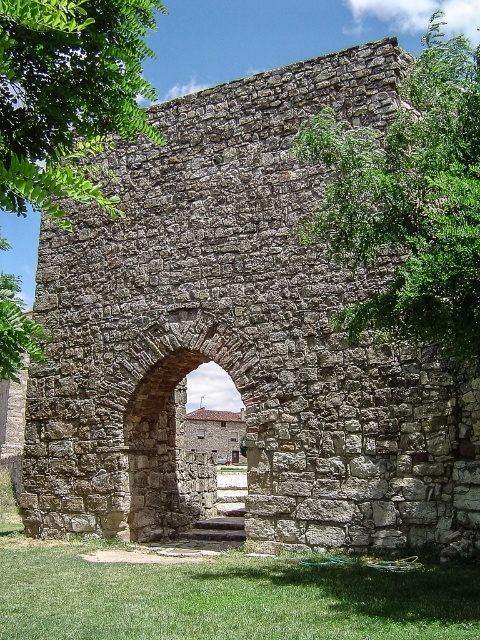
You are standing in a park and see the green grass at lower center and the rustic stone archway at center. Which object is nearer to you?

The green grass at lower center is closer to the viewer than the rustic stone archway at center.

You are a landscape architect designing a walking path that must pass between the green grass at lower center and the green leafy tree at upper left. The path must be at least 20 meters long. Can the path be placed in this location?

The distance between the green grass at lower center and the green leafy tree at upper left is 21.40 meters, which meets the minimum requirement of 20 meters. Therefore, the path can be placed in this location.

You are standing in front of the historic stone archway and want to take a photo that includes both the green grass at lower center and the green leafy tree at upper left. Which object will appear closer to you in the photo?

The green grass at lower center will appear closer to you in the photo because it is further to the viewer than the green leafy tree at upper left.